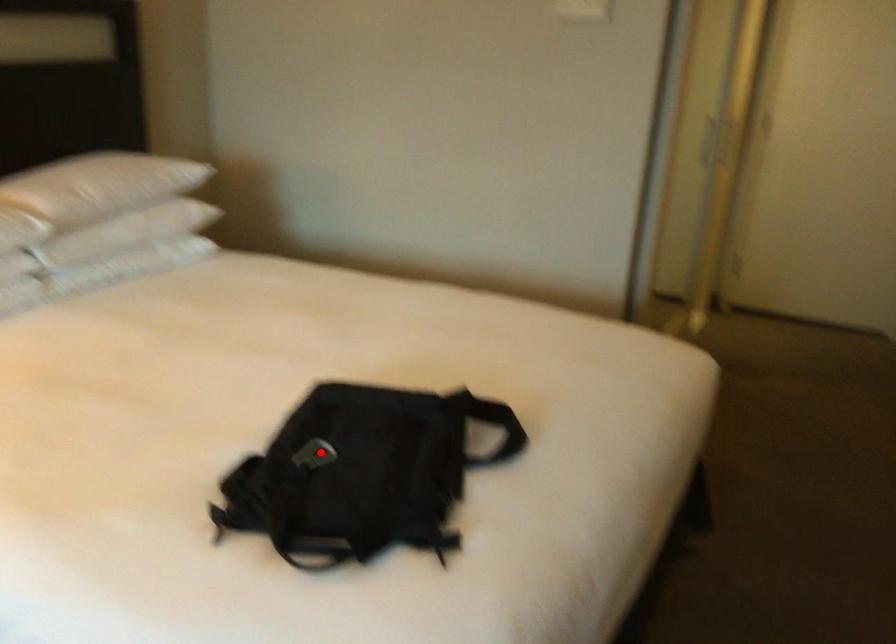
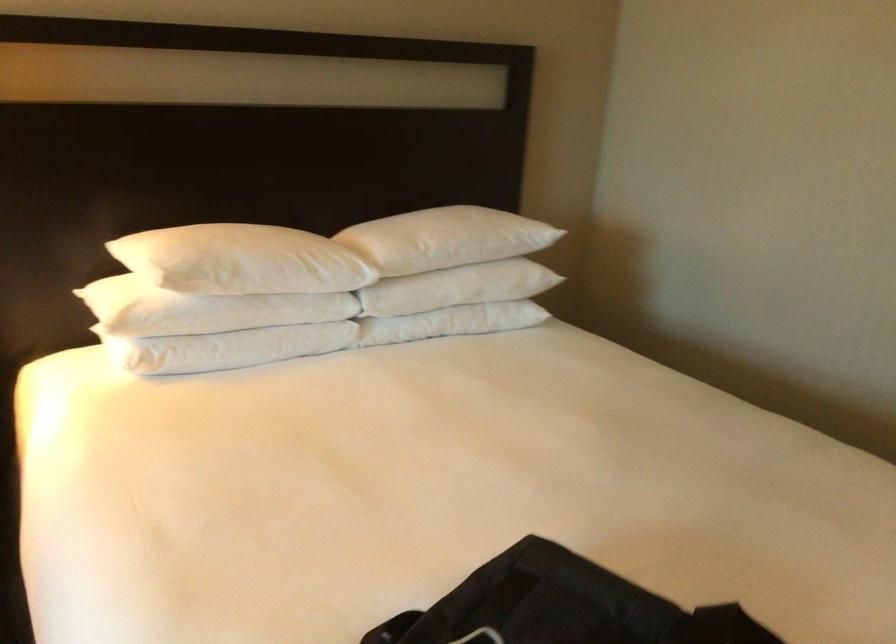
Question: I am providing you with two images of the same scene from different viewpoints. A red point is shown in image1. For the corresponding object point in image2, is it positioned nearer or farther from the camera?

Choices:
 (A) Nearer
 (B) Farther

Answer: (A)